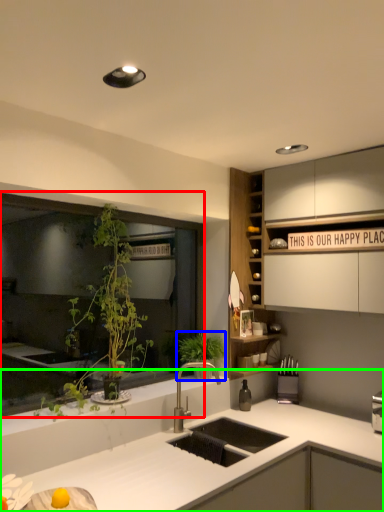
Question: Which object is positioned farthest from window (highlighted by a red box)? Select from vegetation (highlighted by a blue box) and countertop (highlighted by a green box).

Choices:
 (A) vegetation
 (B) countertop

Answer: (B)